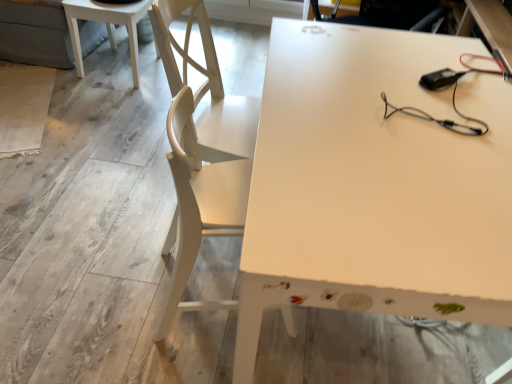
The height and width of the screenshot is (384, 512). In order to click on vacant region below white wood chair at left (from a real-world perspective) in this screenshot , I will do `click(210, 289)`.